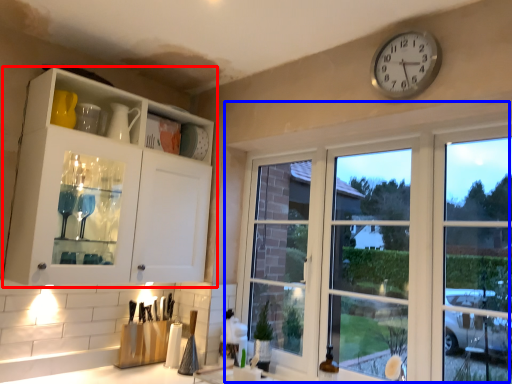
Question: Which of the following is the farthest to the observer, cabinetry (highlighted by a red box) or window (highlighted by a blue box)?

Choices:
 (A) cabinetry
 (B) window

Answer: (A)